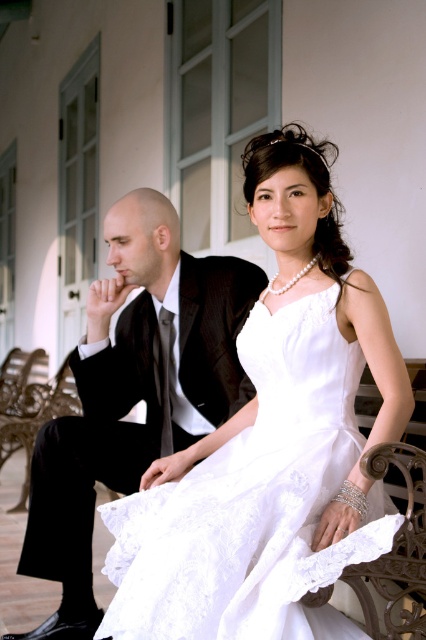
Question: Which point appears farthest from the camera in this image?

Choices:
 (A) (261, 609)
 (B) (85, 518)

Answer: (B)

Question: Considering the relative positions of white lace dress at center and matte black suit at left in the image provided, where is white lace dress at center located with respect to matte black suit at left?

Choices:
 (A) left
 (B) right

Answer: (B)

Question: Which of the following is the farthest from the observer?

Choices:
 (A) (91, 333)
 (B) (273, 499)

Answer: (A)

Question: Does white lace dress at center appear under matte black suit at left?

Choices:
 (A) yes
 (B) no

Answer: (A)

Question: Does white lace dress at center have a smaller size compared to matte black suit at left?

Choices:
 (A) no
 (B) yes

Answer: (B)